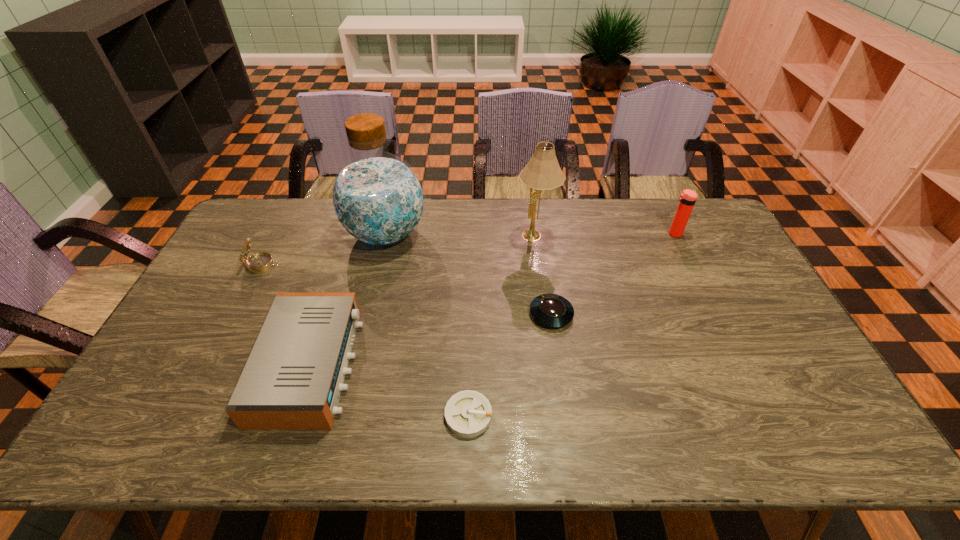
Where is `free spot between the lampshade and the water jug`? The image size is (960, 540). free spot between the lampshade and the water jug is located at coordinates (461, 235).

Where is `free space that is in between the fourth shortest object and the saucer`? The width and height of the screenshot is (960, 540). free space that is in between the fourth shortest object and the saucer is located at coordinates (407, 289).

Where is `vacant space in between the third tallest object and the ashtray`? The image size is (960, 540). vacant space in between the third tallest object and the ashtray is located at coordinates (571, 325).

The width and height of the screenshot is (960, 540). Find the location of `unoccupied position between the second shortest object and the compass`. unoccupied position between the second shortest object and the compass is located at coordinates point(407,289).

At what (x,y) coordinates should I click in order to perform the action: click on unoccupied area between the radio receiver and the saucer. Please return your answer as a coordinate pair (x, y). This screenshot has width=960, height=540. Looking at the image, I should click on (431, 340).

You are a GUI agent. You are given a task and a screenshot of the screen. Output one action in this format:
    pyautogui.click(x=<x>, y=<y>)
    Task: Click on the vacant space that's between the rightmost object and the leftmost object
    The image size is (960, 540).
    Given the screenshot: What is the action you would take?
    pyautogui.click(x=468, y=249)

Select which object appears as the second closest to the fifth tallest object. Please provide its 2D coordinates. Your answer should be formatted as a tuple, i.e. [(x, y)], where the tuple contains the x and y coordinates of a point satisfying the conditions above.

[(378, 199)]

The width and height of the screenshot is (960, 540). Find the location of `object that is the closest to the fourth shortest object`. object that is the closest to the fourth shortest object is located at coordinates (378, 199).

At what (x,y) coordinates should I click in order to perform the action: click on vacant area in the image that satisfies the following two spatial constraints: 1. with the dial facing the fourth shortest object; 2. on the left side of the sixth tallest object. Please return your answer as a coordinate pair (x, y). The width and height of the screenshot is (960, 540). Looking at the image, I should click on [237, 314].

The height and width of the screenshot is (540, 960). I want to click on free region that satisfies the following two spatial constraints: 1. with the dial facing the fourth tallest object; 2. on the back side of the fourth object from left to right, so click(186, 415).